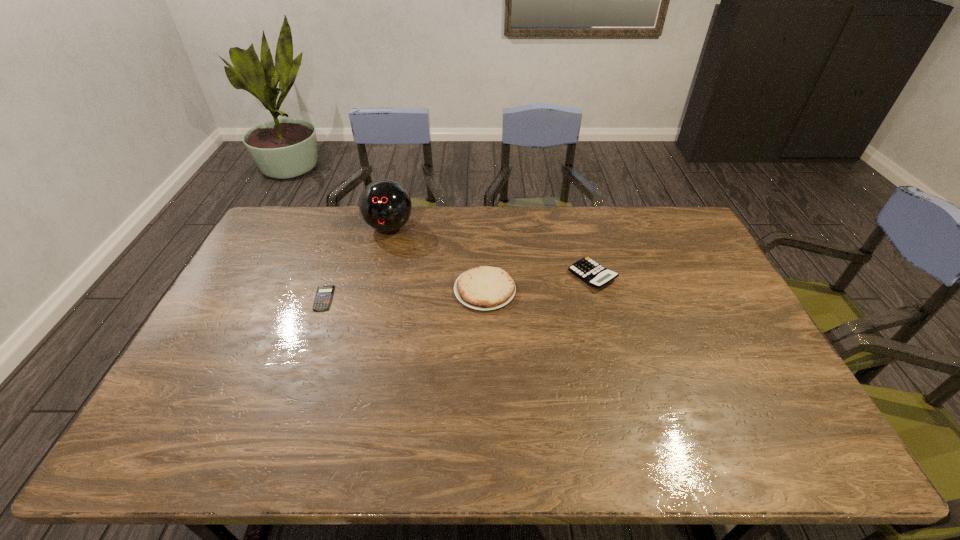
The image size is (960, 540). In order to click on empty space between the bowling ball and the leftmost object in this screenshot , I will do `click(356, 263)`.

The height and width of the screenshot is (540, 960). In order to click on free space that is in between the left calculator and the tallest object in this screenshot , I will do `click(356, 263)`.

Find the location of a particular element. The image size is (960, 540). free space between the tortilla and the left calculator is located at coordinates (404, 294).

What are the coordinates of `free spot between the right calculator and the farthest object` in the screenshot? It's located at (491, 252).

You are a GUI agent. You are given a task and a screenshot of the screen. Output one action in this format:
    pyautogui.click(x=<x>, y=<y>)
    Task: Click on the free point between the left calculator and the tortilla
    This screenshot has height=540, width=960.
    Given the screenshot: What is the action you would take?
    pyautogui.click(x=404, y=294)

Identify which object is the second nearest to the shortest object. Please provide its 2D coordinates. Your answer should be formatted as a tuple, i.e. [(x, y)], where the tuple contains the x and y coordinates of a point satisfying the conditions above.

[(483, 288)]

The image size is (960, 540). Find the location of `object identified as the third closest to the second object from right to left`. object identified as the third closest to the second object from right to left is located at coordinates (324, 294).

You are a GUI agent. You are given a task and a screenshot of the screen. Output one action in this format:
    pyautogui.click(x=<x>, y=<y>)
    Task: Click on the free region that satisfies the following two spatial constraints: 1. on the surface of the bowling ball near the finger holes; 2. on the left side of the taller calculator
    This screenshot has width=960, height=540.
    Given the screenshot: What is the action you would take?
    (x=376, y=276)

You are a GUI agent. You are given a task and a screenshot of the screen. Output one action in this format:
    pyautogui.click(x=<x>, y=<y>)
    Task: Click on the vacant space that satisfies the following two spatial constraints: 1. on the back side of the taller calculator; 2. on the right side of the leftmost object
    The image size is (960, 540).
    Given the screenshot: What is the action you would take?
    pyautogui.click(x=332, y=276)

At what (x,y) coordinates should I click in order to perform the action: click on blank space that satisfies the following two spatial constraints: 1. on the surface of the right calculator near the finger holes; 2. on the right side of the tallest object. Please return your answer as a coordinate pair (x, y). This screenshot has width=960, height=540. Looking at the image, I should click on (376, 276).